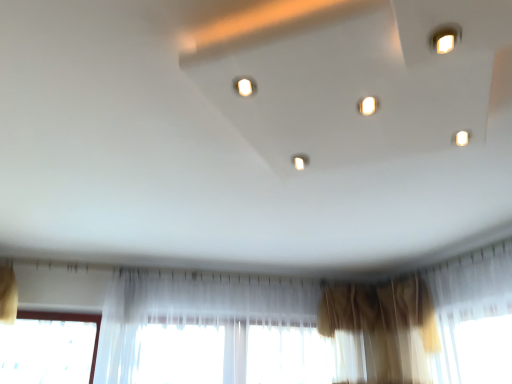
Question: Is matte white light at center, the second light from the bottom, to the left or to the right of translucent fabric curtain at lower center, placed as the 1th curtain when sorted from left to right, in the image?

Choices:
 (A) right
 (B) left

Answer: (A)

Question: Considering the positions of matte white light at center, which appears as the 1th light when viewed from the left, and translucent fabric curtain at lower center, placed as the 1th curtain when sorted from left to right, in the image, is matte white light at center, which appears as the 1th light when viewed from the left, wider or thinner than translucent fabric curtain at lower center, placed as the 1th curtain when sorted from left to right,?

Choices:
 (A) thin
 (B) wide

Answer: (A)

Question: Estimate the real-world distances between objects in this image. Which object is closer to the brown sheer curtain at lower right, which is the 2th curtain from left to right?

Choices:
 (A) matte white light at center, the second light from the bottom
 (B) white glossy light at center, the first light from the back
 (C) translucent fabric curtain at lower center, placed as the 1th curtain when sorted from left to right

Answer: (C)

Question: Which of these objects is positioned closest to the matte white light at center, the second light when ordered from back to front?

Choices:
 (A) translucent fabric curtain at lower center, placed as the 1th curtain when sorted from left to right
 (B) white glossy light at center, which ranks as the 1th light in right-to-left order
 (C) brown sheer curtain at lower right, which is the 2th curtain from left to right

Answer: (B)